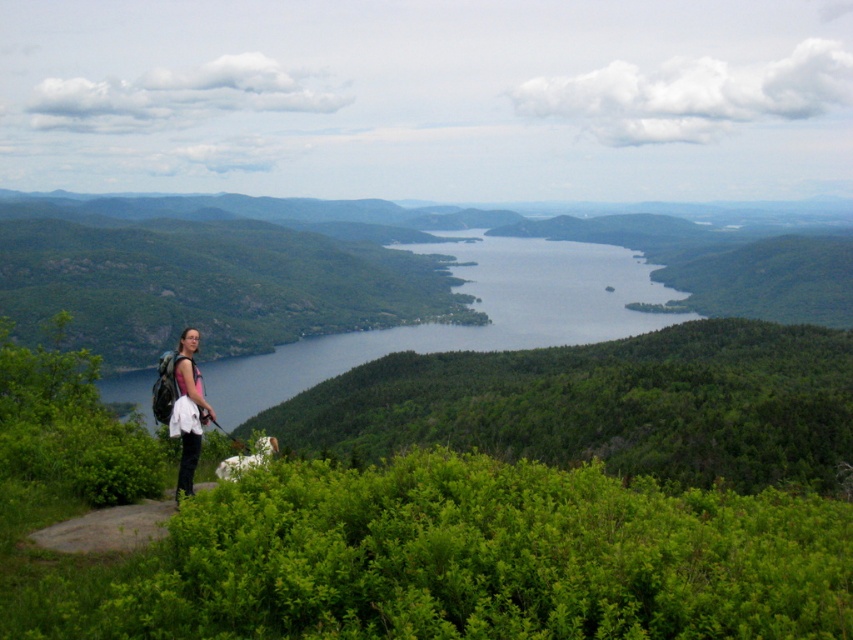
Who is shorter, green grassy hillside at lower left or matte pink shirt at left?

matte pink shirt at left

Describe the element at coordinates (468, 324) in the screenshot. This screenshot has height=640, width=853. I see `green grassy hillside at lower left` at that location.

The height and width of the screenshot is (640, 853). Find the location of `green grassy hillside at lower left`. green grassy hillside at lower left is located at coordinates (468, 324).